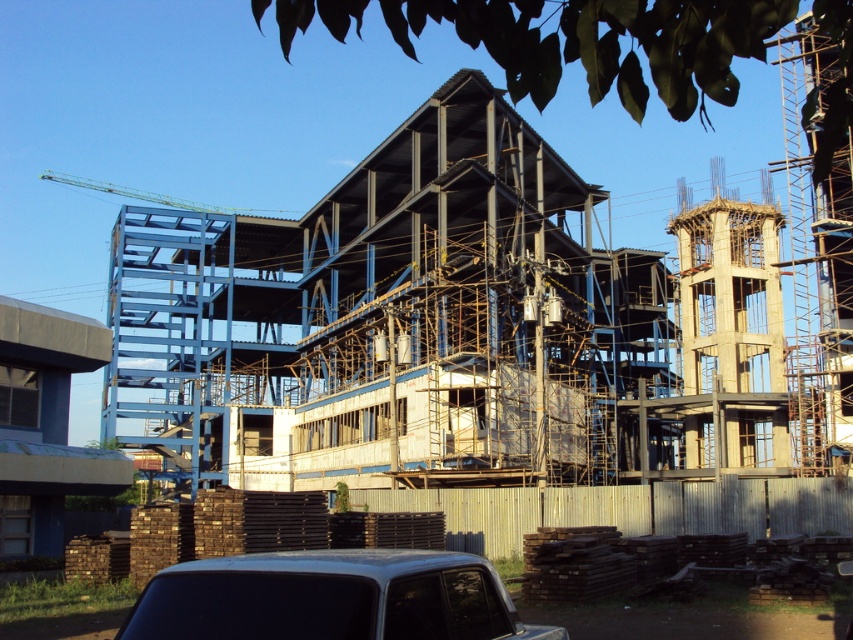
Is silver metallic car at lower center to the right of green metallic crane at upper left from the viewer's perspective?

Indeed, silver metallic car at lower center is positioned on the right side of green metallic crane at upper left.

Does point (323, 618) come in front of point (167, 200)?

Yes, point (323, 618) is in front of point (167, 200).

Does point (154, 589) come behind point (194, 205)?

No, (154, 589) is closer to viewer.

Locate an element on the screen. The image size is (853, 640). silver metallic car at lower center is located at coordinates (329, 598).